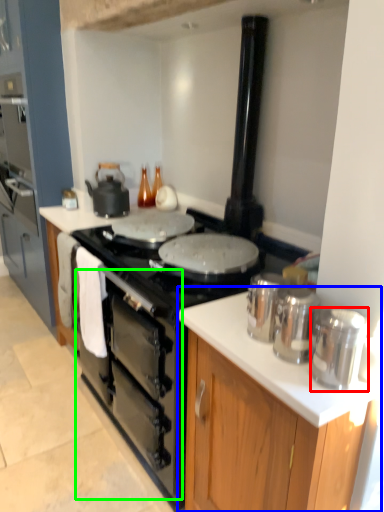
Question: Estimate the real-world distances between objects in this image. Which object is closer to kitchen appliance (highlighted by a red box), cabinetry (highlighted by a blue box) or oven (highlighted by a green box)?

Choices:
 (A) cabinetry
 (B) oven

Answer: (A)